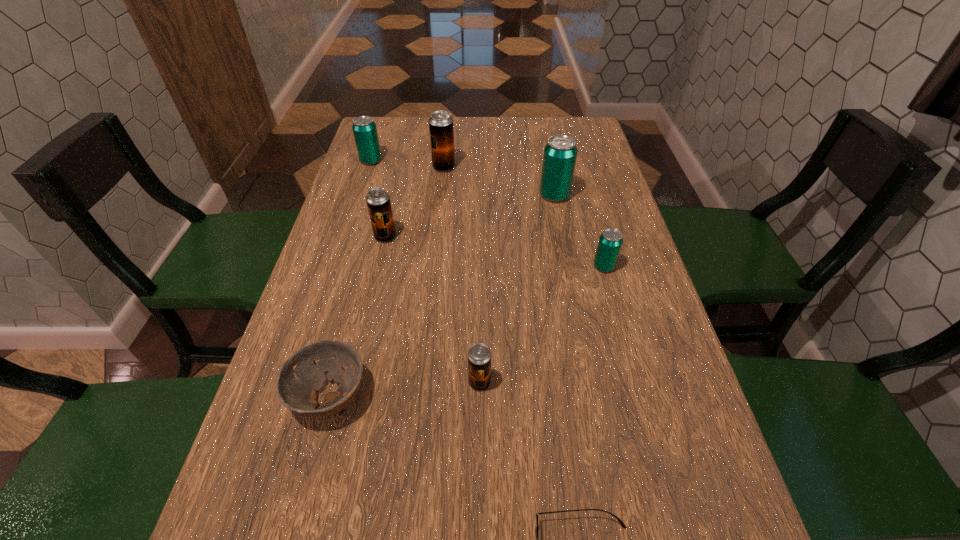
Where is `empty location between the fifth object from right to left and the smallest black beer can`? empty location between the fifth object from right to left and the smallest black beer can is located at coordinates (462, 275).

Locate an element on the screen. This screenshot has height=540, width=960. empty space between the leftmost teal beer can and the bowl is located at coordinates (350, 278).

Locate an element on the screen. This screenshot has height=540, width=960. free spot between the rightmost black beer can and the third beer can from left to right is located at coordinates (462, 275).

Image resolution: width=960 pixels, height=540 pixels. Find the location of `vacant space that is in between the nearest beer can and the fourth object from left to right`. vacant space that is in between the nearest beer can and the fourth object from left to right is located at coordinates (462, 275).

The image size is (960, 540). Find the location of `vacant region between the nearest teal beer can and the fifth nearest object`. vacant region between the nearest teal beer can and the fifth nearest object is located at coordinates (494, 252).

Where is `the closest object to the second smallest black beer can`? This screenshot has height=540, width=960. the closest object to the second smallest black beer can is located at coordinates (441, 130).

Select which object appears as the third closest to the fourth farthest beer can. Please provide its 2D coordinates. Your answer should be formatted as a tuple, i.e. [(x, y)], where the tuple contains the x and y coordinates of a point satisfying the conditions above.

[(301, 376)]

Locate which beer can is the second closest to the second black beer can from right to left. Please provide its 2D coordinates. Your answer should be formatted as a tuple, i.e. [(x, y)], where the tuple contains the x and y coordinates of a point satisfying the conditions above.

[(560, 153)]

Select which beer can is the fifth closest to the second farthest teal beer can. Please provide its 2D coordinates. Your answer should be formatted as a tuple, i.e. [(x, y)], where the tuple contains the x and y coordinates of a point satisfying the conditions above.

[(479, 355)]

Select which black beer can is the closest to the shortest object. Please provide its 2D coordinates. Your answer should be formatted as a tuple, i.e. [(x, y)], where the tuple contains the x and y coordinates of a point satisfying the conditions above.

[(479, 355)]